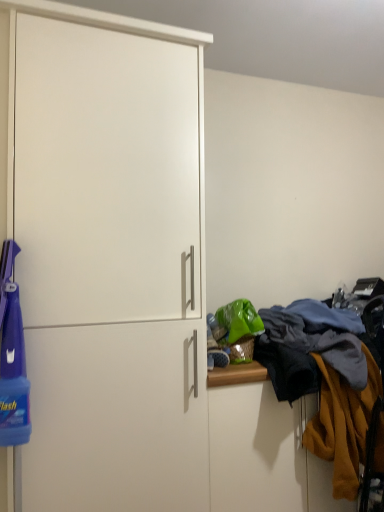
Question: Based on their positions, is textured woolen sweater at right located to the left or right of mustard yellow fabric at right?

Choices:
 (A) right
 (B) left

Answer: (B)

Question: From the image's perspective, is textured woolen sweater at right positioned above or below mustard yellow fabric at right?

Choices:
 (A) below
 (B) above

Answer: (B)

Question: Considering the real-world distances, which object is closest to the mustard yellow fabric at right?

Choices:
 (A) white matte cabinet at left
 (B) textured woolen sweater at right

Answer: (B)

Question: Estimate the real-world distances between objects in this image. Which object is farther from the mustard yellow fabric at right?

Choices:
 (A) white matte cabinet at left
 (B) textured woolen sweater at right

Answer: (A)